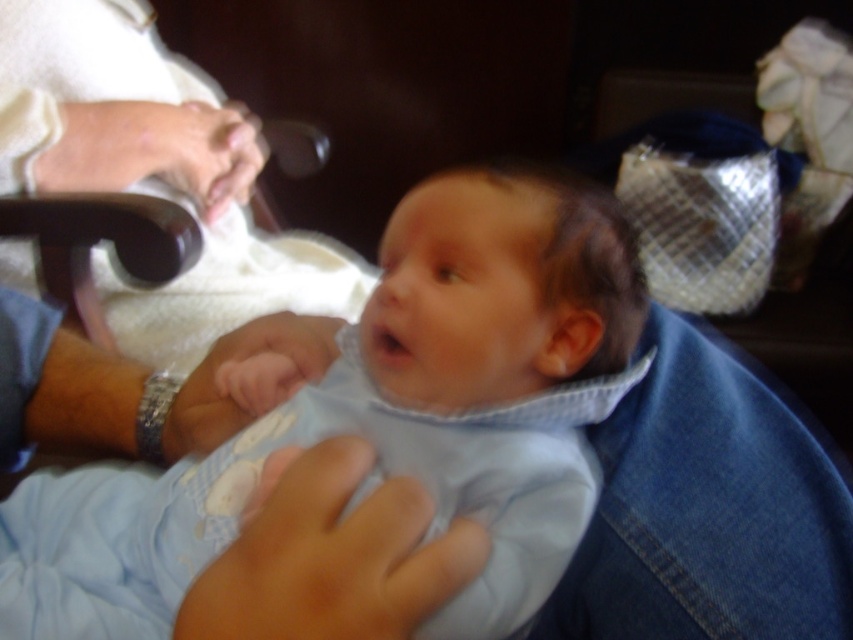
The baby is held by an adult whose wristwatch is visible. The light blue quilted fabric at center is part of the baby clothing. How far apart are the baby and the wristwatch?

The baby and the wristwatch are 13.55 inches apart.

Consider the image. You are a photographer standing 24 inches away from the scene. You want to take a closeup photo of the baby. The point you need to focus on is point (431, 198). Is the point within your focus range?

The distance of point (431, 198) from viewer is 18.91 inches. Since you are standing 24 inches away from the scene, the point is within your focus range because it is closer than your current distance.